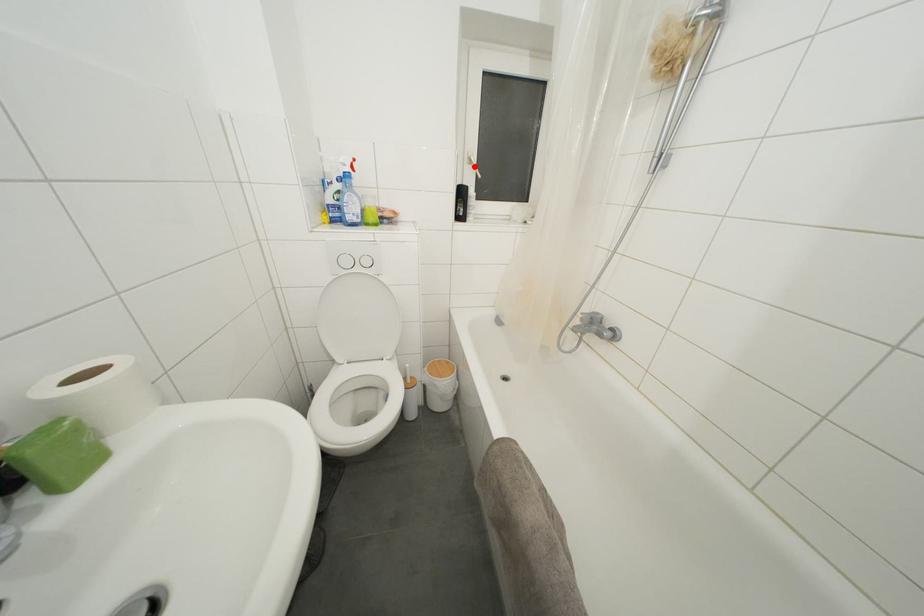
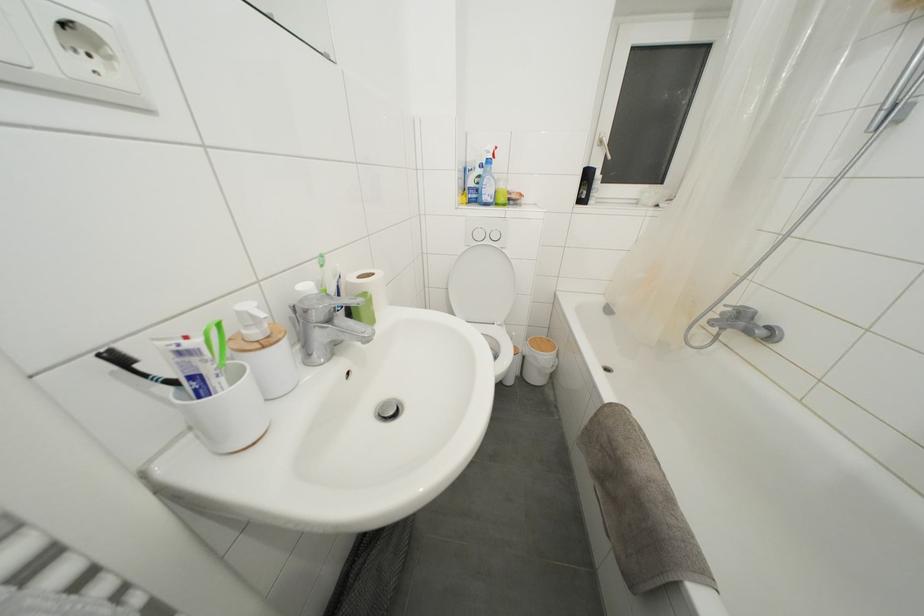
Locate, in the second image, the point that corresponds to the highlighted location in the first image.

(604, 148)